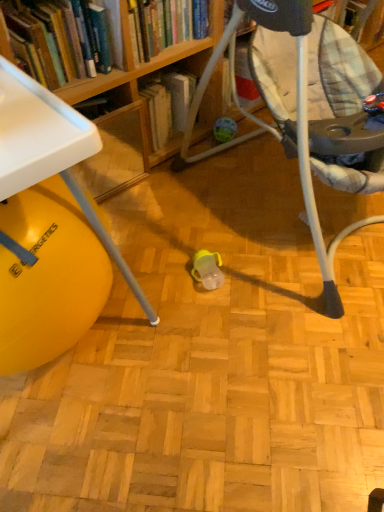
Question: Does white plastic table at lower left have a lesser height compared to hardcover book at upper left, which is counted as the 2th book, starting from the left?

Choices:
 (A) yes
 (B) no

Answer: (B)

Question: Could you tell me if white plastic table at lower left is turned towards hardcover book at upper left, the first book from the right?

Choices:
 (A) yes
 (B) no

Answer: (A)

Question: From the image's perspective, is white plastic table at lower left above hardcover book at upper left, which is counted as the 2th book, starting from the left?

Choices:
 (A) no
 (B) yes

Answer: (A)

Question: Does white plastic table at lower left have a larger size compared to hardcover book at upper left, the first book from the right?

Choices:
 (A) no
 (B) yes

Answer: (B)

Question: Is white plastic table at lower left in contact with hardcover book at upper left, the first book from the right?

Choices:
 (A) yes
 (B) no

Answer: (B)

Question: Is white plastic table at lower left to the left of hardcover book at upper left, which is counted as the 2th book, starting from the left, from the viewer's perspective?

Choices:
 (A) no
 (B) yes

Answer: (B)

Question: From a real-world perspective, is hardcover book at upper left, the first book when ordered from left to right, physically above matte plastic baby swing at center?

Choices:
 (A) no
 (B) yes

Answer: (B)

Question: Can you confirm if hardcover book at upper left, the first book when ordered from left to right, is smaller than matte plastic baby swing at center?

Choices:
 (A) yes
 (B) no

Answer: (A)

Question: Is hardcover book at upper left, the first book when ordered from left to right, not within matte plastic baby swing at center?

Choices:
 (A) no
 (B) yes

Answer: (B)

Question: Can you confirm if hardcover book at upper left, the first book when ordered from left to right, is taller than matte plastic baby swing at center?

Choices:
 (A) yes
 (B) no

Answer: (B)

Question: Can you confirm if hardcover book at upper left, the first book when ordered from left to right, is bigger than matte plastic baby swing at center?

Choices:
 (A) yes
 (B) no

Answer: (B)

Question: Does hardcover book at upper left, the first book when ordered from left to right, have a lesser width compared to matte plastic baby swing at center?

Choices:
 (A) yes
 (B) no

Answer: (A)

Question: Considering the relative sizes of hardcover book at upper left, the first book from the right, and hardcover book at upper left, the first book when ordered from left to right, in the image provided, is hardcover book at upper left, the first book from the right, thinner than hardcover book at upper left, the first book when ordered from left to right,?

Choices:
 (A) no
 (B) yes

Answer: (A)